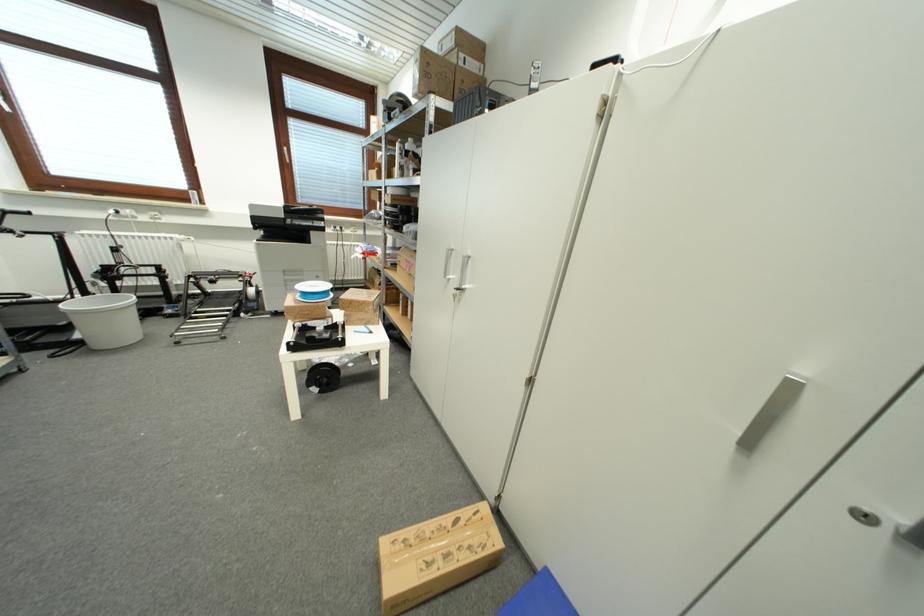
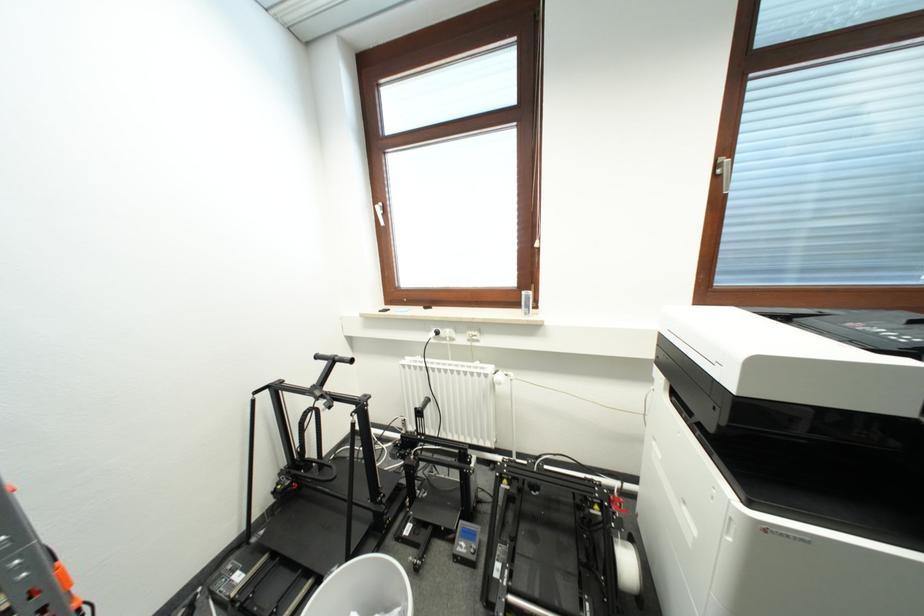
Where in the second image is the point corresponding to the point at 297,126 from the first image?

(766, 89)